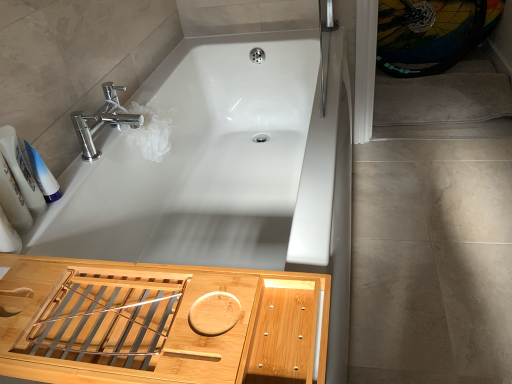
At what (x,y) coordinates should I click in order to perform the action: click on free space above bamboo tray at lower left (from a real-world perspective). Please return your answer as a coordinate pair (x, y). This screenshot has height=384, width=512. Looking at the image, I should click on tap(140, 285).